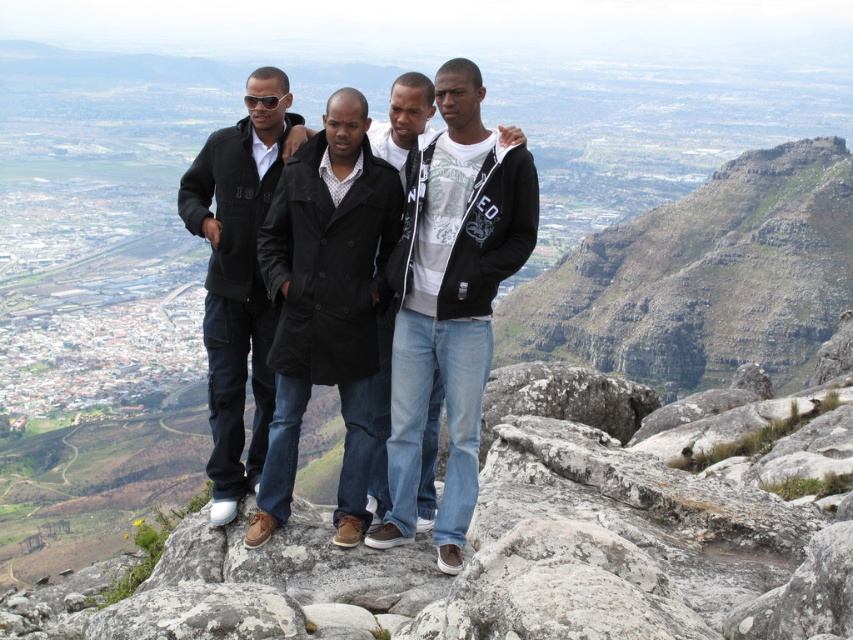
Question: Estimate the real-world distances between objects in this image. Which object is closer to the black matte coat at center?

Choices:
 (A) rugged stone mountain at upper right
 (B) black fleece jacket at center

Answer: (B)

Question: Does rugged stone mountain at upper right have a smaller size compared to black fleece jacket at center?

Choices:
 (A) yes
 (B) no

Answer: (B)

Question: Observing the image, what is the correct spatial positioning of rugged stone mountain at upper right in reference to black matte coat at center?

Choices:
 (A) below
 (B) above

Answer: (B)

Question: Which of the following is the farthest from the observer?

Choices:
 (A) matte black coat at center
 (B) black fleece jacket at center
 (C) rugged stone mountain at upper right

Answer: (C)

Question: Which object appears closest to the camera in this image?

Choices:
 (A) black matte coat at center
 (B) black fleece jacket at center
 (C) rugged stone mountain at upper right

Answer: (A)

Question: Does black matte coat at center appear over matte black coat at center?

Choices:
 (A) yes
 (B) no

Answer: (B)